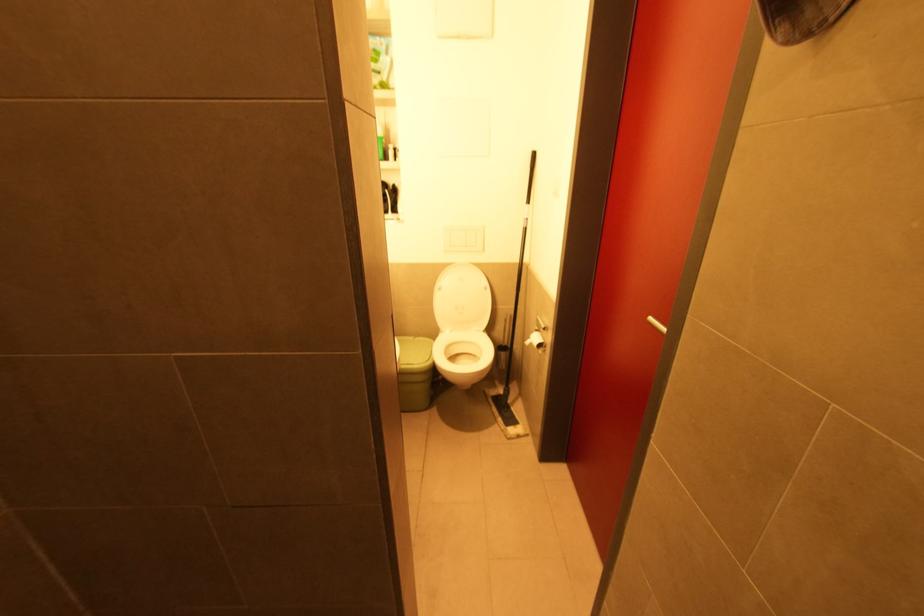
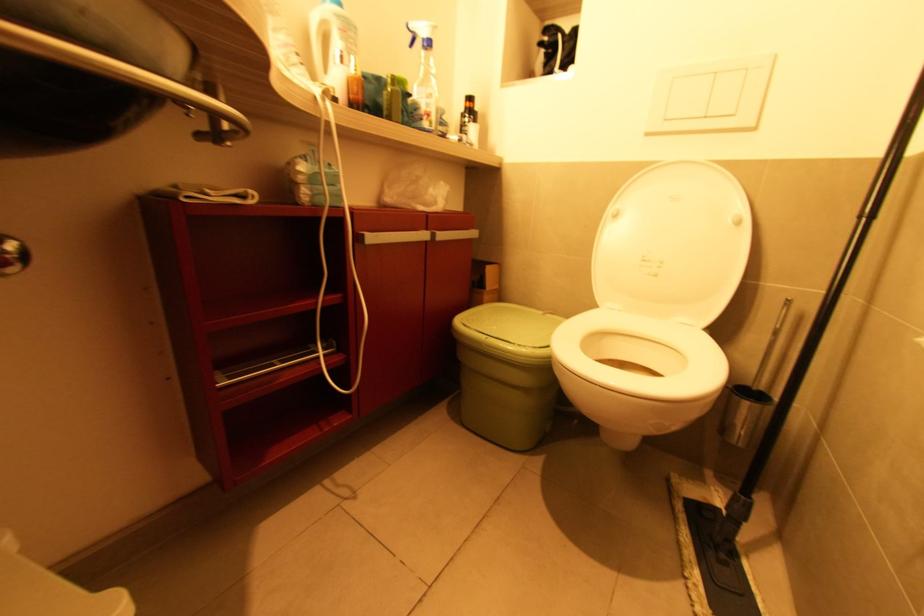
The point at (505, 326) is marked in the first image. Where is the corresponding point in the second image?

(771, 338)